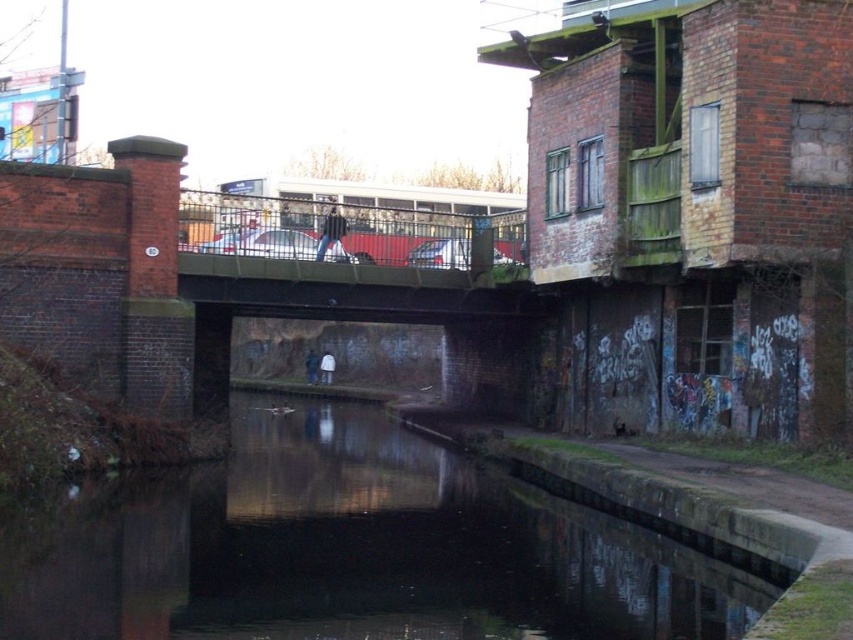
You are a photographer standing on the bridge and see the dark concrete water at center and the white matte jacket at center. Which object would you focus on to capture a wider area in your photo?

The dark concrete water at center has a larger size compared to the white matte jacket at center, so focusing on it would allow you to capture a wider area in your photo.

Based on the photo, you are a photographer standing on the bridge in the image. You want to capture a photo of the dark concrete water at center and the dark blue jeans at center. Which object appears shorter in the photo?

The dark concrete water at center is not as tall as dark blue jeans at center, so the dark concrete water at center will appear shorter in the photo.